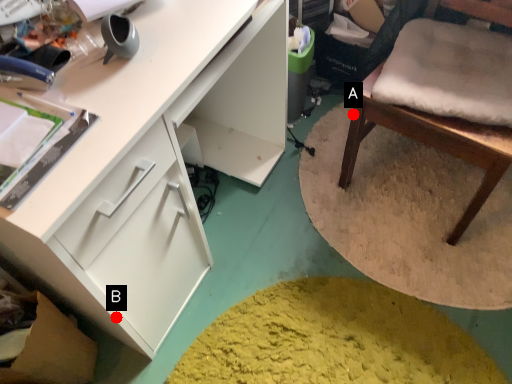
Question: Two points are circled on the image, labeled by A and B beside each circle. Which point appears closest to the camera in this image?

Choices:
 (A) A is closer
 (B) B is closer

Answer: (B)